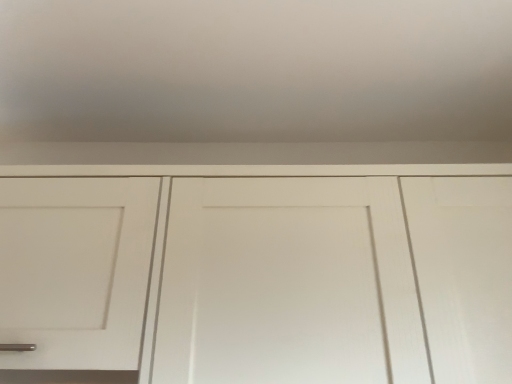
The image size is (512, 384). Find the location of `white wood cupboard at center`. white wood cupboard at center is located at coordinates (257, 170).

Looking at this image, measure the distance between white wood cupboard at center and camera.

white wood cupboard at center is 29.54 inches from camera.

What do you see at coordinates (257, 170) in the screenshot? I see `white wood cupboard at center` at bounding box center [257, 170].

The height and width of the screenshot is (384, 512). I want to click on white wood cupboard at center, so click(x=257, y=170).